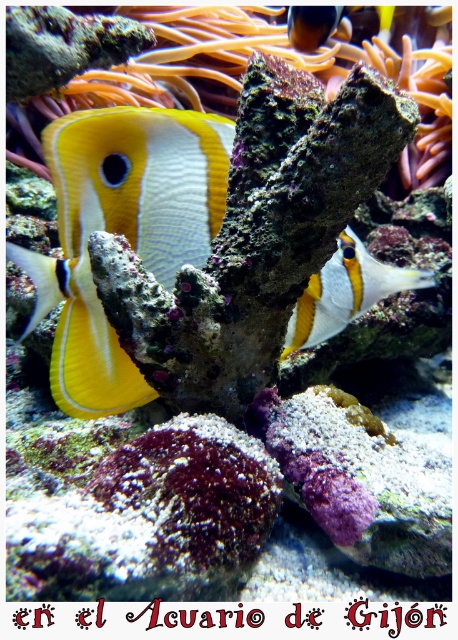
Question: Does yellow matte butterflyfish at center have a larger size compared to yellow and white coral-like fish at center?

Choices:
 (A) no
 (B) yes

Answer: (B)

Question: Which of the following is the closest to the observer?

Choices:
 (A) (96, 417)
 (B) (391, 294)

Answer: (A)

Question: Is yellow matte butterflyfish at center smaller than yellow and white coral-like fish at center?

Choices:
 (A) no
 (B) yes

Answer: (A)

Question: Is the position of yellow matte butterflyfish at center less distant than that of yellow and white coral-like fish at center?

Choices:
 (A) no
 (B) yes

Answer: (B)